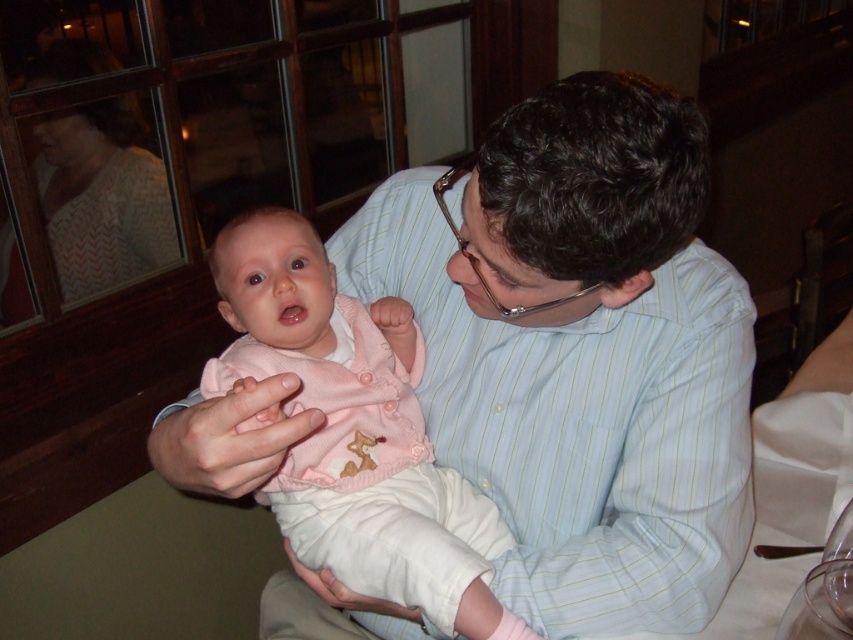
Between light blue striped shirt at center and pink knitted sweater at center, which one appears on the right side from the viewer's perspective?

From the viewer's perspective, light blue striped shirt at center appears more on the right side.

Between light blue striped shirt at center and pink knitted sweater at center, which one has less height?

pink knitted sweater at center

At what (x,y) coordinates should I click in order to perform the action: click on light blue striped shirt at center. Please return your answer as a coordinate pair (x, y). This screenshot has height=640, width=853. Looking at the image, I should click on (581, 352).

Identify the location of light blue striped shirt at center. (581, 352).